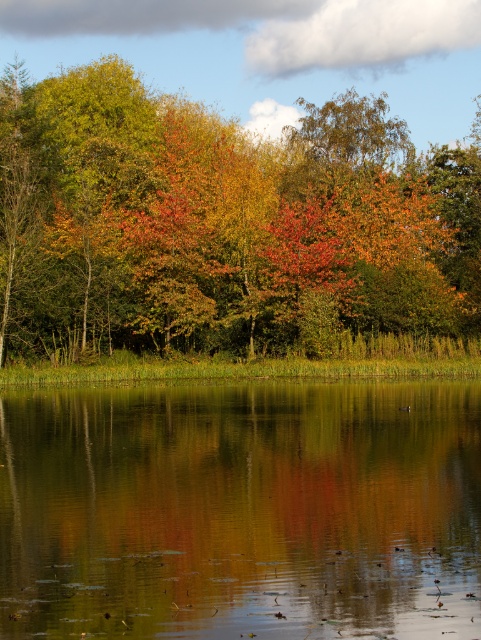
Question: Does green reflective water at center have a smaller size compared to autumn foliage at center?

Choices:
 (A) no
 (B) yes

Answer: (B)

Question: Does green reflective water at center have a greater width compared to autumn foliage at center?

Choices:
 (A) yes
 (B) no

Answer: (B)

Question: Which point is closer to the camera?

Choices:
 (A) (0, 204)
 (B) (450, 596)

Answer: (B)

Question: Which of the following is the closest to the observer?

Choices:
 (A) green reflective water at center
 (B) autumn foliage at center

Answer: (A)

Question: Does green reflective water at center have a smaller size compared to autumn foliage at center?

Choices:
 (A) yes
 (B) no

Answer: (A)